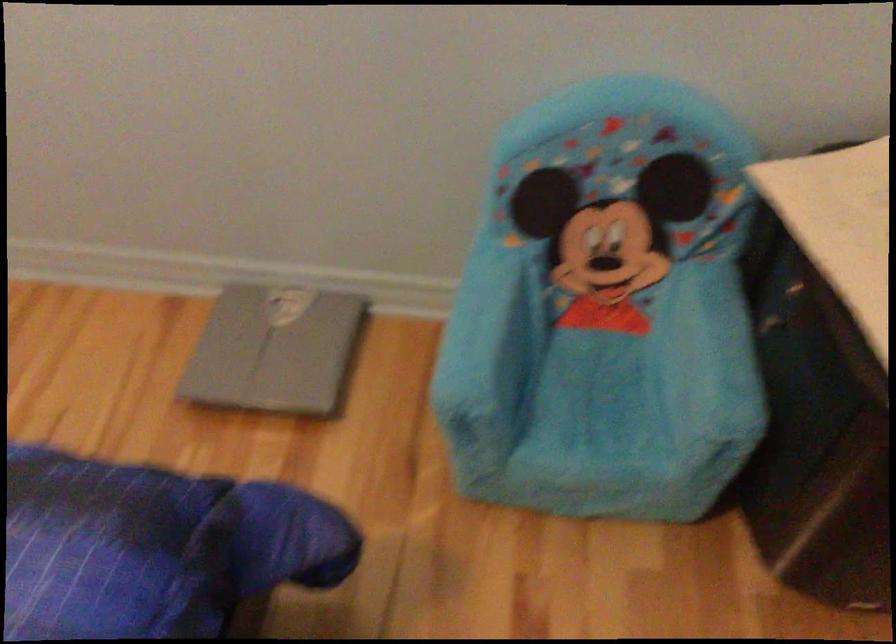
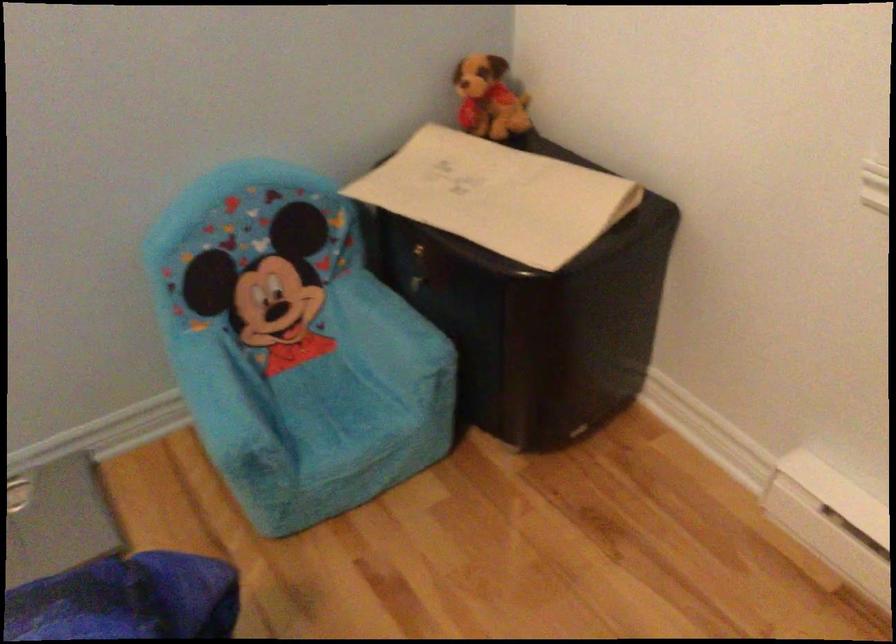
Locate, in the second image, the point that corresponds to (495,310) in the first image.

(225, 379)